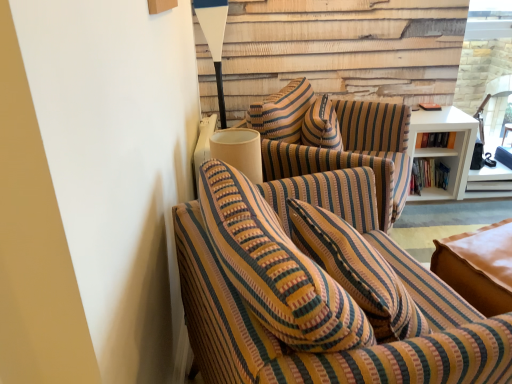
Question: Is white matte shelf at right facing away from striped fabric couch at center, the first studio couch positioned from the back?

Choices:
 (A) yes
 (B) no

Answer: (B)

Question: Does white matte shelf at right have a greater width compared to striped fabric couch at center, the first studio couch positioned from the back?

Choices:
 (A) yes
 (B) no

Answer: (B)

Question: Are white matte shelf at right and striped fabric couch at center, positioned as the second studio couch in front-to-back order, located far from each other?

Choices:
 (A) no
 (B) yes

Answer: (A)

Question: Considering the relative sizes of white matte shelf at right and striped fabric couch at center, the first studio couch positioned from the back, in the image provided, is white matte shelf at right thinner than striped fabric couch at center, the first studio couch positioned from the back,?

Choices:
 (A) no
 (B) yes

Answer: (B)

Question: Is the depth of white matte shelf at right less than that of striped fabric couch at center, the first studio couch positioned from the back?

Choices:
 (A) no
 (B) yes

Answer: (A)

Question: Relative to hardcover books at right, the 1th book in the bottom-to-top sequence, is striped fabric couch at center, positioned as the second studio couch in front-to-back order, in front or behind?

Choices:
 (A) front
 (B) behind

Answer: (A)

Question: Is point (349, 158) positioned closer to the camera than point (429, 168)?

Choices:
 (A) farther
 (B) closer

Answer: (B)

Question: Is striped fabric couch at center, positioned as the second studio couch in front-to-back order, inside the boundaries of hardcover books at right, acting as the second book starting from the top, or outside?

Choices:
 (A) inside
 (B) outside

Answer: (B)

Question: Is striped fabric couch at center, the first studio couch positioned from the back, to the left or to the right of hardcover books at right, the 1th book in the bottom-to-top sequence, in the image?

Choices:
 (A) right
 (B) left

Answer: (B)

Question: Based on their positions, is white matte shelf at right located to the left or right of white glossy table lamp at upper center?

Choices:
 (A) right
 (B) left

Answer: (A)

Question: Looking at the image, does white matte shelf at right seem bigger or smaller compared to white glossy table lamp at upper center?

Choices:
 (A) small
 (B) big

Answer: (B)

Question: In terms of width, does white matte shelf at right look wider or thinner when compared to white glossy table lamp at upper center?

Choices:
 (A) wide
 (B) thin

Answer: (A)

Question: From a real-world perspective, is white matte shelf at right positioned above or below white glossy table lamp at upper center?

Choices:
 (A) below
 (B) above

Answer: (A)

Question: In terms of height, does white matte shelf at right look taller or shorter compared to hardcover books at upper right, which is counted as the first book, starting from the top?

Choices:
 (A) short
 (B) tall

Answer: (B)

Question: From a real-world perspective, relative to hardcover books at upper right, which is counted as the first book, starting from the top, is white matte shelf at right vertically above or below?

Choices:
 (A) below
 (B) above

Answer: (A)